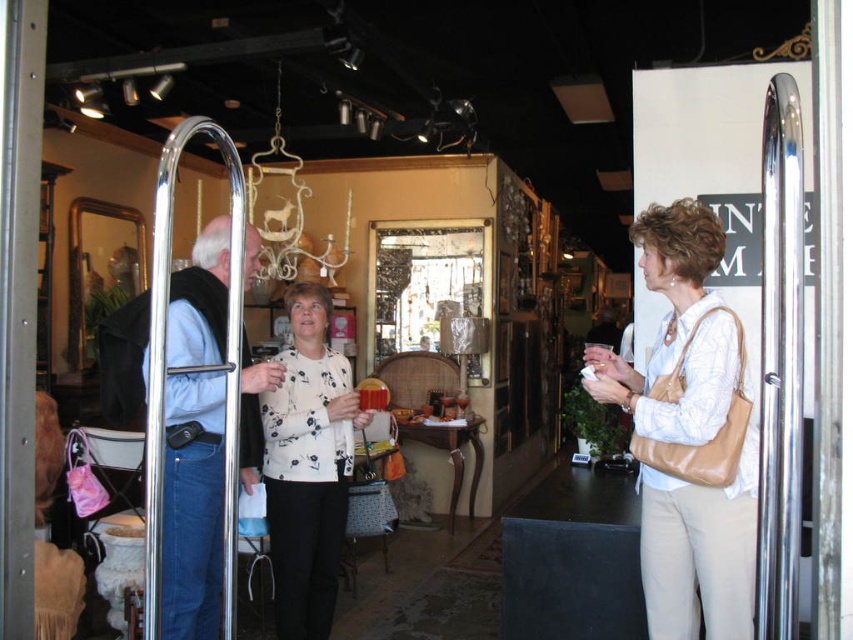
You are a delivery person who needs to place a small package on the beige leather purse at center. The package is 1.5 meters in length. Can you fit the package on the purse without moving it?

The distance between the beige leather purse at center and the camera is 1.82 meters. Since the package is only 1.5 meters long, it can be placed on the purse without needing to move it as there is enough space.